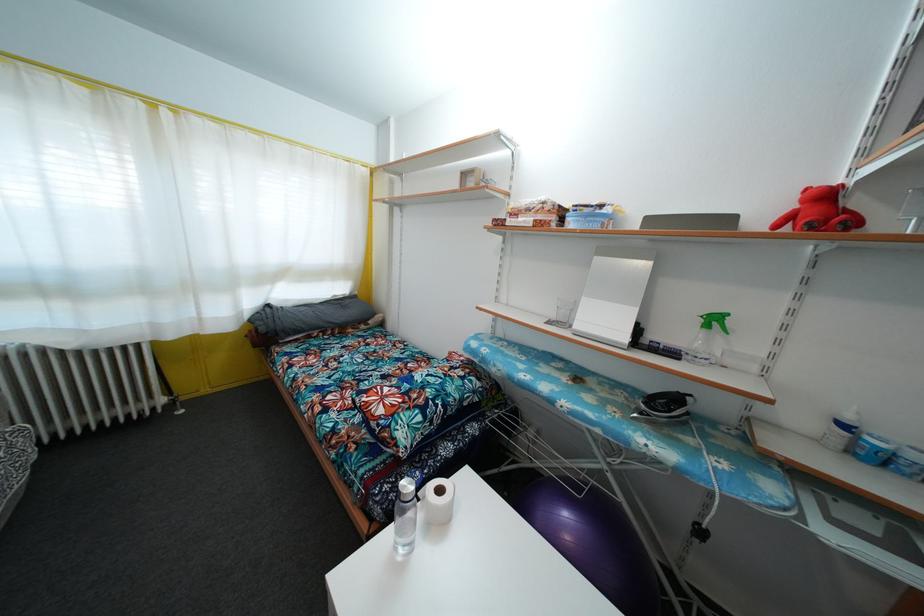
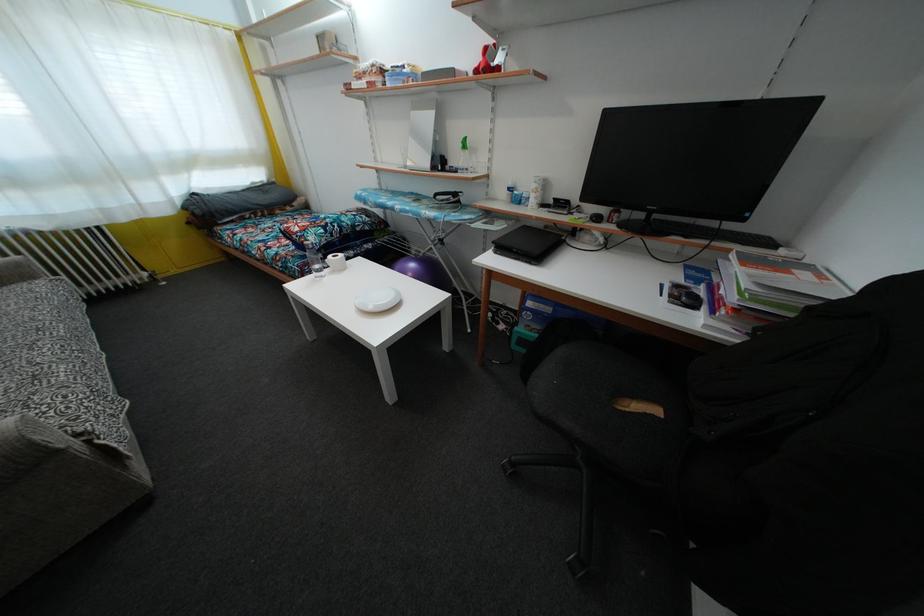
The point at (707, 339) is marked in the first image. Where is the corresponding point in the second image?

(467, 160)